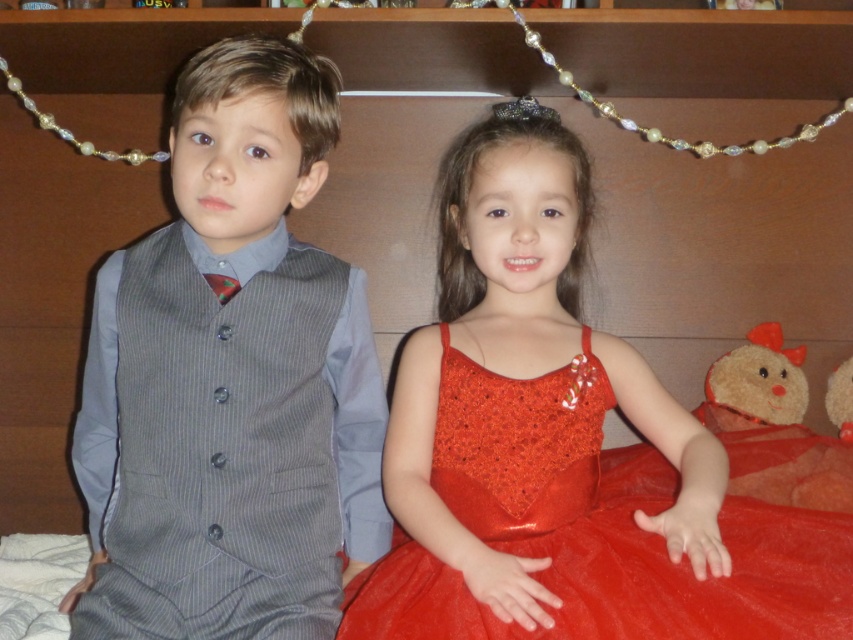
Is point (302, 516) positioned after point (787, 598)?

Yes, it is.

Locate an element on the screen. gray pinstripe vest at left is located at coordinates (231, 380).

Where is `gray pinstripe vest at left`? The width and height of the screenshot is (853, 640). gray pinstripe vest at left is located at coordinates (231, 380).

Looking at this image, who is shorter, gray pinstripe vest at left or fluffy brown teddy bear at lower right?

fluffy brown teddy bear at lower right is shorter.

From the picture: Is gray pinstripe vest at left taller than fluffy brown teddy bear at lower right?

Correct, gray pinstripe vest at left is much taller as fluffy brown teddy bear at lower right.

Is point (355, 300) positioned after point (788, 486)?

No, (355, 300) is in front of (788, 486).

Identify the location of gray pinstripe vest at left. (231, 380).

Does shiny tulle dress at center have a larger size compared to fluffy brown teddy bear at lower right?

Indeed, shiny tulle dress at center has a larger size compared to fluffy brown teddy bear at lower right.

Is point (390, 604) positioned behind point (778, 472)?

No.

You are a GUI agent. You are given a task and a screenshot of the screen. Output one action in this format:
    pyautogui.click(x=<x>, y=<y>)
    Task: Click on the shiny tulle dress at center
    The width and height of the screenshot is (853, 640).
    Given the screenshot: What is the action you would take?
    pyautogui.click(x=592, y=529)